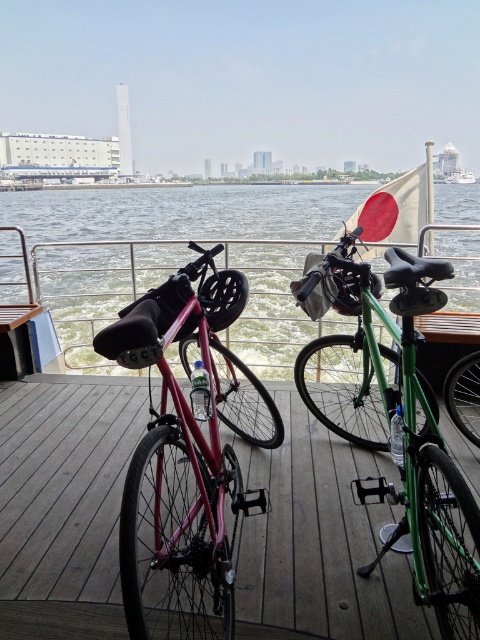
Question: Does matte black bicycle at center appear over green glossy water at center?

Choices:
 (A) no
 (B) yes

Answer: (A)

Question: Is green glossy water at center bigger than green matte bicycle at center?

Choices:
 (A) yes
 (B) no

Answer: (A)

Question: Which object is the farthest from the green matte bicycle at center?

Choices:
 (A) green glossy water at center
 (B) matte pink bike at left
 (C) matte black bicycle at center

Answer: (A)

Question: Does matte black bicycle at center have a lesser width compared to green matte bicycle at center?

Choices:
 (A) yes
 (B) no

Answer: (B)

Question: Based on their relative distances, which object is nearer to the green matte bicycle at center?

Choices:
 (A) matte black bicycle at center
 (B) matte pink bike at left

Answer: (B)

Question: Among these points, which one is nearest to the camera?

Choices:
 (A) (196, 451)
 (B) (64, 529)
 (C) (471, 609)
 (D) (444, 204)

Answer: (C)